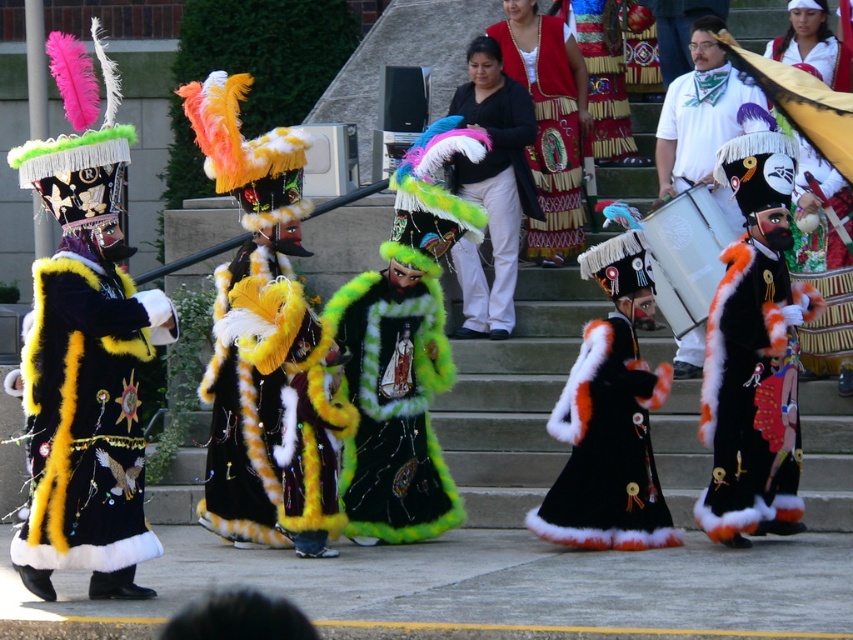
You are a photographer at the event and need to capture a photo that includes both the green fuzzy coat at center and the embroidered velvet dress at center. Which one should you focus on first to ensure it appears in the foreground?

The green fuzzy coat at center is located below the embroidered velvet dress at center, so focusing on the embroidered velvet dress at center first will place it in the foreground since it is higher up.

You are a photographer positioned at the front of the stage. You want to capture both the black fur robe at left and the embroidered velvet dress at center in a single frame. Which performer should you adjust your camera angle towards to ensure both are visible?

You should adjust your camera angle towards the embroidered velvet dress at center since the black fur robe at left is positioned to the left of it, ensuring both will be in frame when centered on the dress.